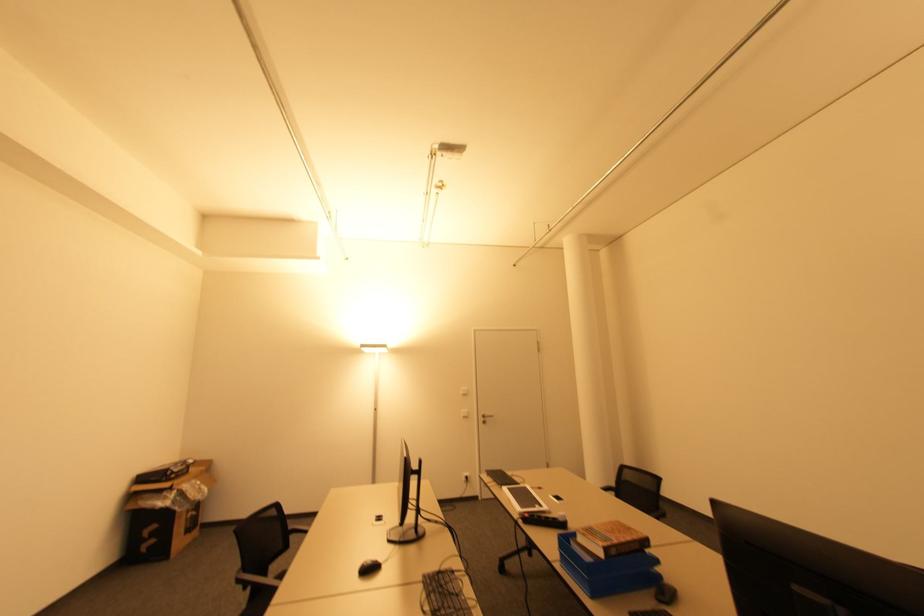
Where would you sit the black chair sitting surface? Please return your answer as a coordinate pair (x, y).

(274, 584)